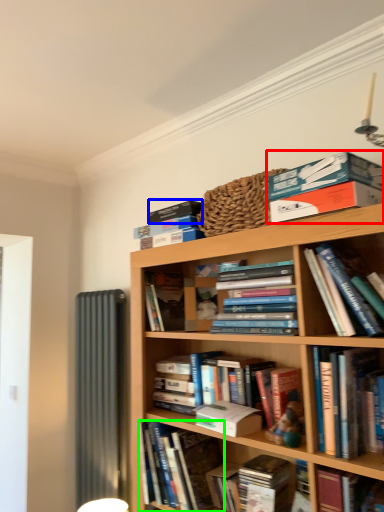
Question: Considering the real-world distances, which object is farthest from book (highlighted by a red box)? paperback book (highlighted by a blue box) or book (highlighted by a green box)?

Choices:
 (A) paperback book
 (B) book

Answer: (B)